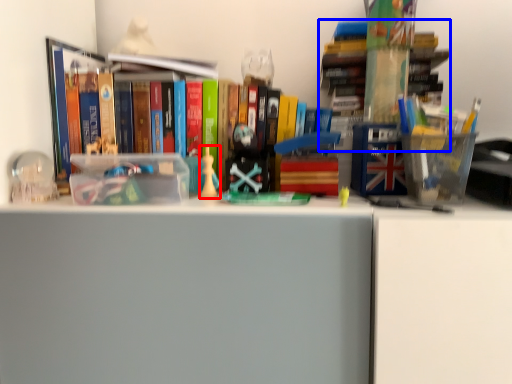
Question: Which object is closer to the camera taking this photo, toy (highlighted by a red box) or book (highlighted by a blue box)?

Choices:
 (A) toy
 (B) book

Answer: (B)